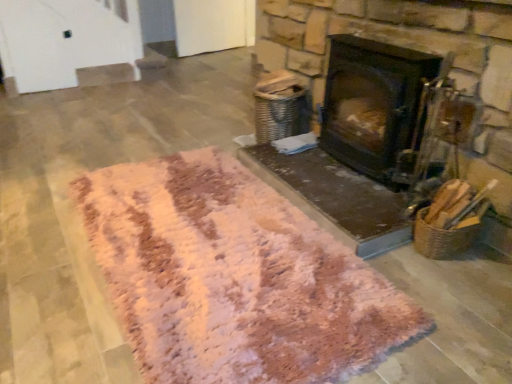
Question: Should I look upward or downward to see black matte wood burning stove at center?

Choices:
 (A) down
 (B) up

Answer: (B)

Question: Is black matte wood burning stove at center far away from pink shaggy rug at center?

Choices:
 (A) no
 (B) yes

Answer: (A)

Question: Considering the relative sizes of black matte wood burning stove at center and pink shaggy rug at center in the image provided, is black matte wood burning stove at center smaller than pink shaggy rug at center?

Choices:
 (A) no
 (B) yes

Answer: (B)

Question: From a real-world perspective, is black matte wood burning stove at center positioned over pink shaggy rug at center based on gravity?

Choices:
 (A) no
 (B) yes

Answer: (B)

Question: Can you confirm if black matte wood burning stove at center is bigger than pink shaggy rug at center?

Choices:
 (A) yes
 (B) no

Answer: (B)

Question: Is black matte wood burning stove at center positioned beyond the bounds of pink shaggy rug at center?

Choices:
 (A) yes
 (B) no

Answer: (A)

Question: Can you confirm if black matte wood burning stove at center is positioned to the right of pink shaggy rug at center?

Choices:
 (A) no
 (B) yes

Answer: (B)

Question: Can you confirm if pink shaggy rug at center is shorter than black matte wood burning stove at center?

Choices:
 (A) no
 (B) yes

Answer: (B)

Question: Is pink shaggy rug at center taller than black matte wood burning stove at center?

Choices:
 (A) no
 (B) yes

Answer: (A)

Question: Is black matte wood burning stove at center inside pink shaggy rug at center?

Choices:
 (A) yes
 (B) no

Answer: (B)

Question: Is pink shaggy rug at center facing away from black matte wood burning stove at center?

Choices:
 (A) no
 (B) yes

Answer: (A)

Question: Is pink shaggy rug at center aimed at black matte wood burning stove at center?

Choices:
 (A) yes
 (B) no

Answer: (B)

Question: From a real-world perspective, is pink shaggy rug at center beneath black matte wood burning stove at center?

Choices:
 (A) no
 (B) yes

Answer: (B)

Question: From a real-world perspective, is pink shaggy rug at center above or below black matte wood burning stove at center?

Choices:
 (A) below
 (B) above

Answer: (A)